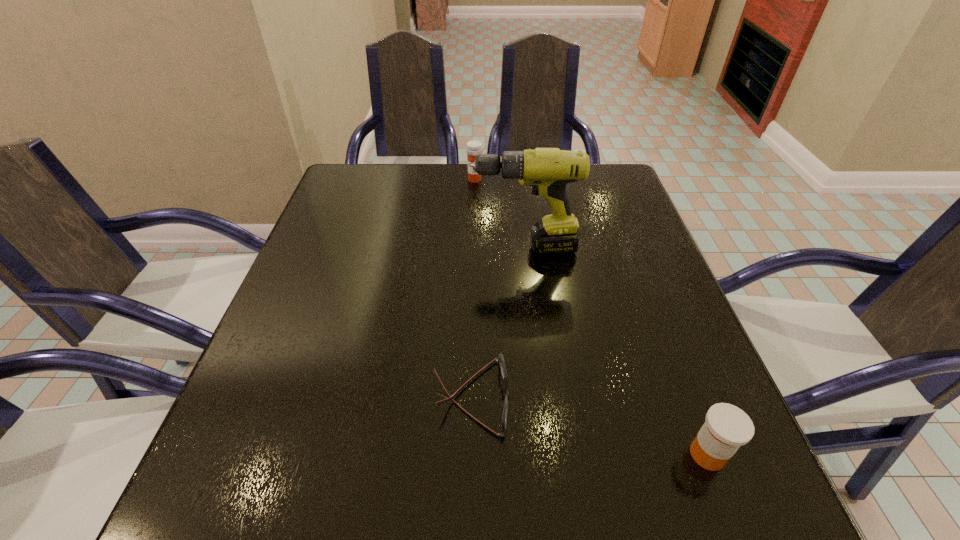
This screenshot has height=540, width=960. Identify the location of blank space at the far left corner of the desktop. (385, 170).

You are a GUI agent. You are given a task and a screenshot of the screen. Output one action in this format:
    pyautogui.click(x=<x>, y=<y>)
    Task: Click on the vacant space at the near left corner of the desktop
    The height and width of the screenshot is (540, 960).
    Given the screenshot: What is the action you would take?
    pyautogui.click(x=308, y=498)

Image resolution: width=960 pixels, height=540 pixels. In order to click on vacant space at the far right corner of the desktop in this screenshot , I will do `click(619, 188)`.

You are a GUI agent. You are given a task and a screenshot of the screen. Output one action in this format:
    pyautogui.click(x=<x>, y=<y>)
    Task: Click on the free space at the near right corner of the desktop
    The image size is (960, 540).
    Given the screenshot: What is the action you would take?
    pyautogui.click(x=779, y=514)

You are a GUI agent. You are given a task and a screenshot of the screen. Output one action in this format:
    pyautogui.click(x=<x>, y=<y>)
    Task: Click on the free space between the second farthest object and the shortest object
    Image resolution: width=960 pixels, height=540 pixels.
    Given the screenshot: What is the action you would take?
    pyautogui.click(x=497, y=322)

This screenshot has height=540, width=960. I want to click on free point between the spectacles and the drill, so (497, 322).

This screenshot has width=960, height=540. I want to click on empty space that is in between the farther medicine and the second farthest object, so click(499, 213).

Where is `free space between the tallest object and the nearer medicine`? free space between the tallest object and the nearer medicine is located at coordinates (615, 351).

The width and height of the screenshot is (960, 540). Identify the location of empty location between the tallest object and the farthest object. (499, 213).

Locate an element on the screen. free spot between the spectacles and the third nearest object is located at coordinates (497, 322).